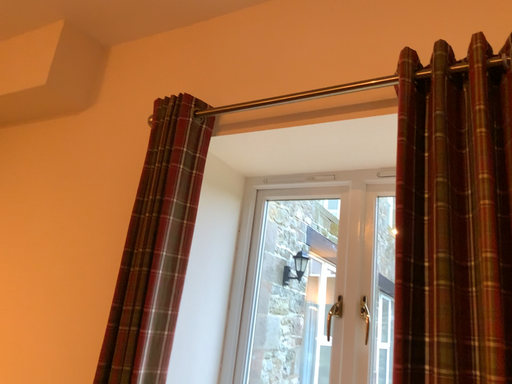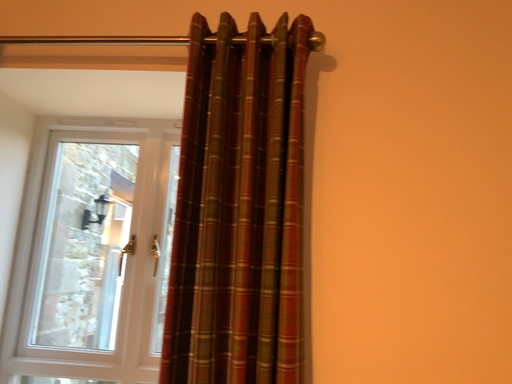
Question: How did the camera likely rotate when shooting the video?

Choices:
 (A) rotated upward
 (B) rotated downward

Answer: (B)